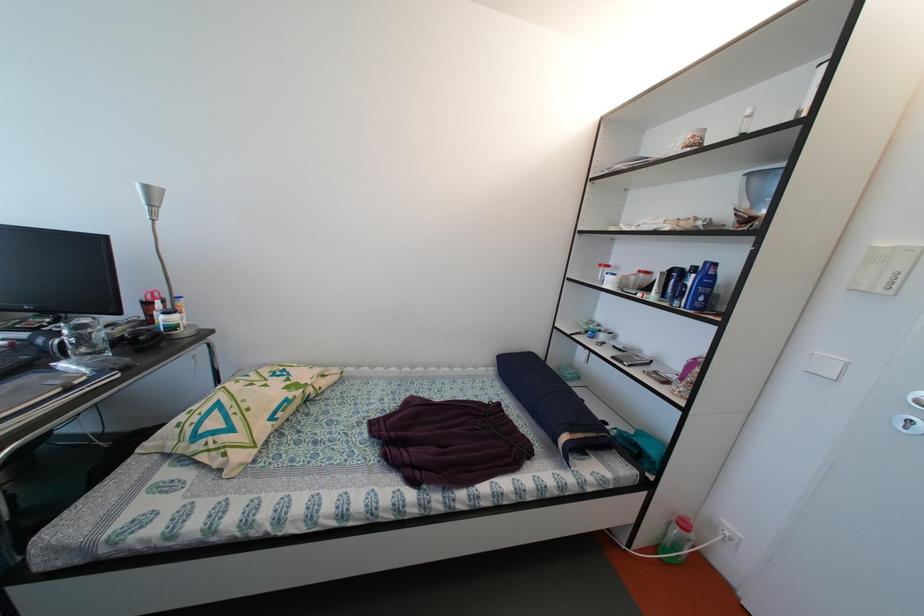
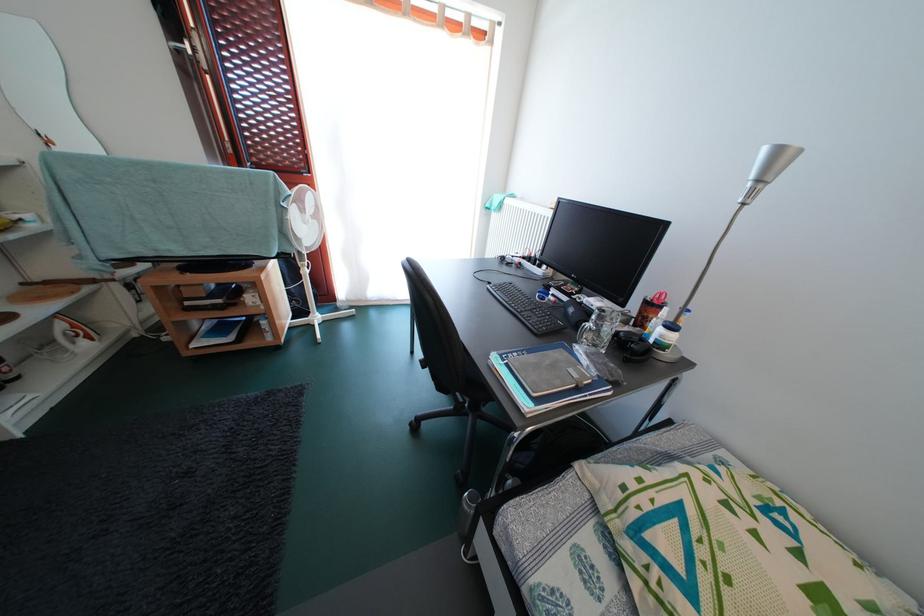
In the second image, find the point that corresponds to point 154,193 in the first image.

(785, 156)